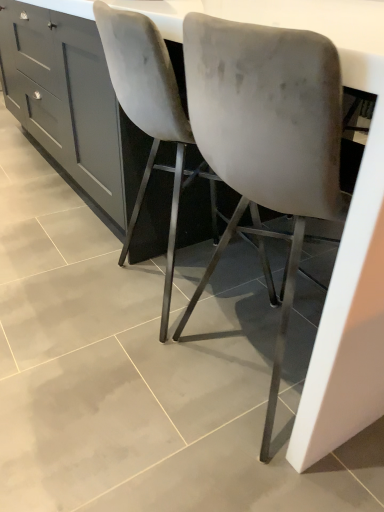
Question: Can you confirm if matte gray cabinet at center is thinner than velvet grey chair at center, which ranks as the first chair in right-to-left order?

Choices:
 (A) no
 (B) yes

Answer: (A)

Question: Is matte gray cabinet at center in front of velvet grey chair at center, which is the second chair from left to right?

Choices:
 (A) yes
 (B) no

Answer: (B)

Question: Does matte gray cabinet at center have a greater width compared to velvet grey chair at center, which is the second chair from left to right?

Choices:
 (A) yes
 (B) no

Answer: (A)

Question: From the image's perspective, does matte gray cabinet at center appear lower than velvet grey chair at center, which ranks as the first chair in right-to-left order?

Choices:
 (A) yes
 (B) no

Answer: (B)

Question: Considering the relative sizes of matte gray cabinet at center and velvet grey chair at center, which is the second chair from left to right, in the image provided, is matte gray cabinet at center taller than velvet grey chair at center, which is the second chair from left to right,?

Choices:
 (A) yes
 (B) no

Answer: (B)

Question: Does matte gray cabinet at center have a larger size compared to velvet grey chair at center, which is the second chair from left to right?

Choices:
 (A) yes
 (B) no

Answer: (A)

Question: Is velvet-like gray chair at center, which ranks as the 2th chair in right-to-left order, facing away from matte gray cabinet at center?

Choices:
 (A) no
 (B) yes

Answer: (A)

Question: Is velvet-like gray chair at center, which ranks as the 2th chair in right-to-left order, beside matte gray cabinet at center?

Choices:
 (A) no
 (B) yes

Answer: (A)

Question: Considering the relative sizes of velvet-like gray chair at center, which ranks as the 2th chair in right-to-left order, and matte gray cabinet at center in the image provided, is velvet-like gray chair at center, which ranks as the 2th chair in right-to-left order, taller than matte gray cabinet at center?

Choices:
 (A) no
 (B) yes

Answer: (B)

Question: From a real-world perspective, does velvet-like gray chair at center, which ranks as the 2th chair in right-to-left order, stand above matte gray cabinet at center?

Choices:
 (A) yes
 (B) no

Answer: (A)

Question: Does velvet-like gray chair at center, the 1th chair when ordered from left to right, turn towards matte gray cabinet at center?

Choices:
 (A) yes
 (B) no

Answer: (B)

Question: From the image's perspective, is velvet-like gray chair at center, which ranks as the 2th chair in right-to-left order, on top of matte gray cabinet at center?

Choices:
 (A) yes
 (B) no

Answer: (B)

Question: Does matte gray cabinet at center have a lesser width compared to white glossy counter at center?

Choices:
 (A) no
 (B) yes

Answer: (B)